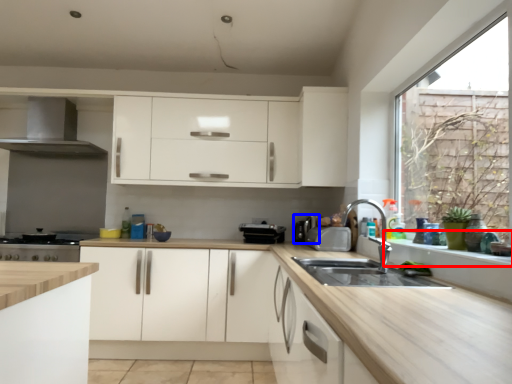
Question: Which object is further to the camera taking this photo, window sill (highlighted by a red box) or appliance (highlighted by a blue box)?

Choices:
 (A) window sill
 (B) appliance

Answer: (B)